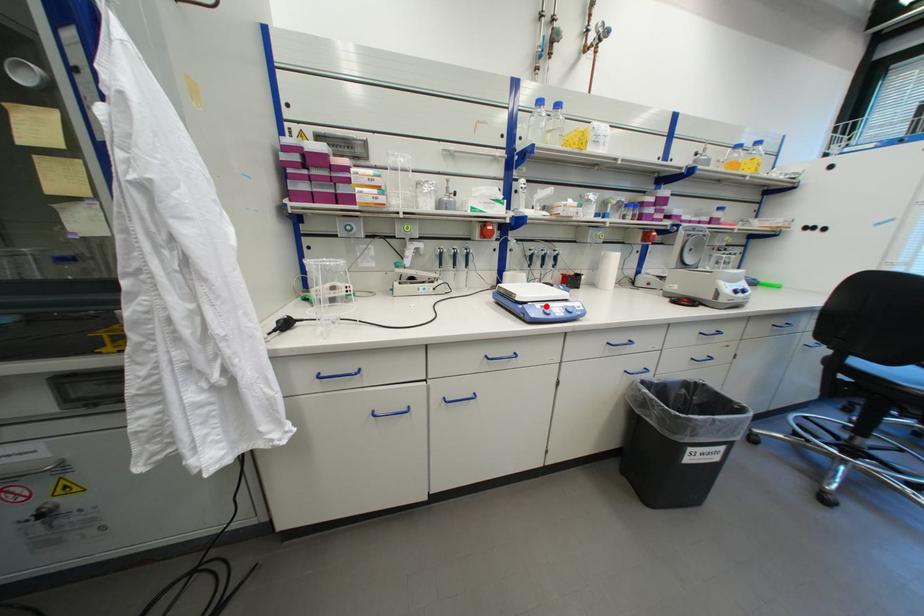
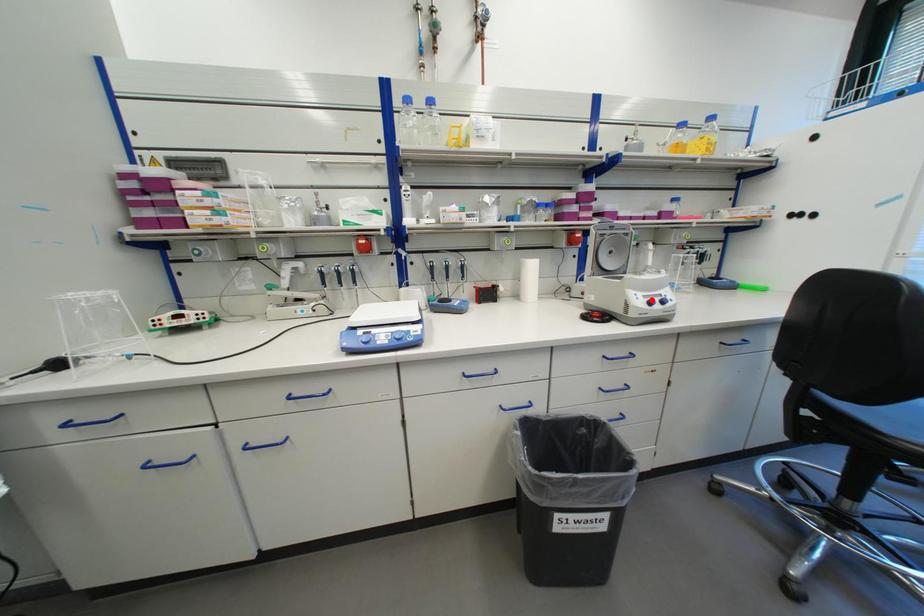
In the scene shown: I am providing you with two images of the same scene from different viewpoints. A red point is marked on the first image and another point is marked on the second image. Is the marked point in image1 the same physical position as the marked point in image2?

No